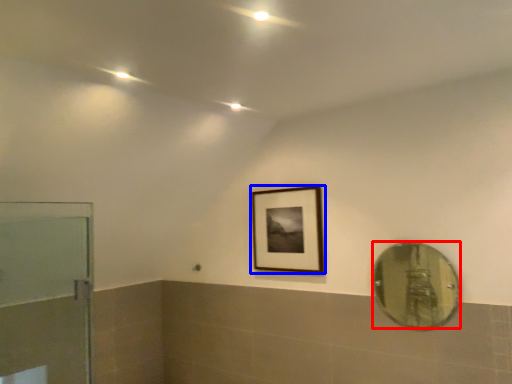
Question: Which object appears closest to the camera in this image, mirror (highlighted by a red box) or picture frame (highlighted by a blue box)?

Choices:
 (A) mirror
 (B) picture frame

Answer: (A)